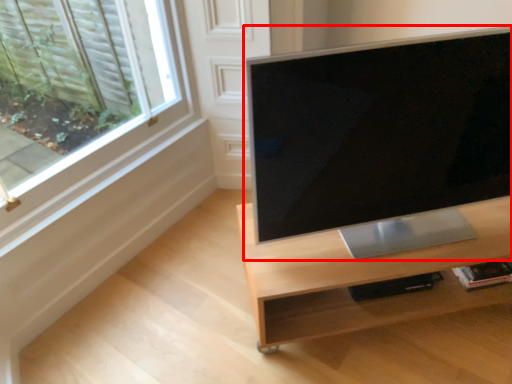
Question: From the image's perspective, considering the relative positions of computer monitor (annotated by the red box) and desk in the image provided, where is computer monitor (annotated by the red box) located with respect to the staircase?

Choices:
 (A) below
 (B) above

Answer: (B)